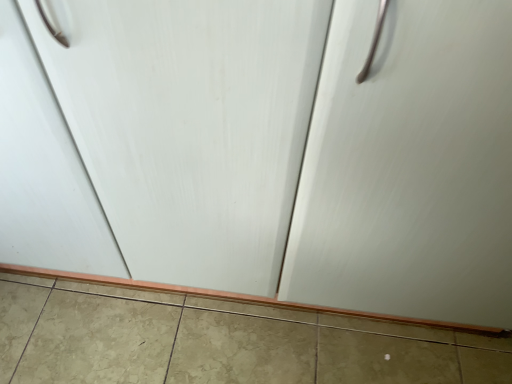
Image resolution: width=512 pixels, height=384 pixels. I want to click on empty space that is ontop of beige marble tile at lower center, so click(229, 340).